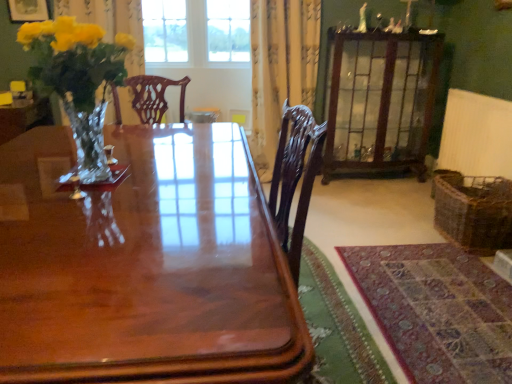
The width and height of the screenshot is (512, 384). I want to click on free spot to the right of shiny glass vase with yellow flowers at left, so click(x=188, y=178).